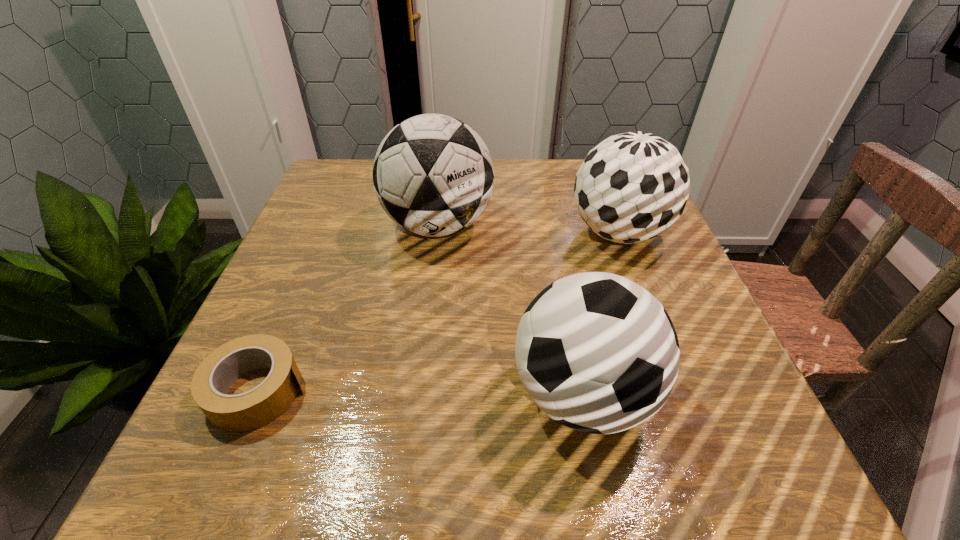
At what (x,y) coordinates should I click in order to perform the action: click on object located in the near left corner section of the desktop. Please return your answer as a coordinate pair (x, y). The height and width of the screenshot is (540, 960). Looking at the image, I should click on (250, 410).

Locate an element on the screen. The image size is (960, 540). object present at the far right corner is located at coordinates (632, 187).

Where is `object at the near right corner`? object at the near right corner is located at coordinates (596, 352).

This screenshot has height=540, width=960. I want to click on blank space at the far edge, so click(563, 183).

Where is `vacant region at the near edge`? vacant region at the near edge is located at coordinates (626, 467).

The width and height of the screenshot is (960, 540). In order to click on vacant space at the right edge of the desktop in this screenshot , I will do `click(676, 310)`.

The image size is (960, 540). I want to click on free location at the far left corner of the desktop, so click(344, 158).

Find the location of a particular element. free space at the near left corner of the desktop is located at coordinates (241, 486).

Identify the location of vacant space at the near right corner. (693, 448).

Locate an element on the screen. The height and width of the screenshot is (540, 960). vacant region between the leftmost soccer ball and the duct tape is located at coordinates (348, 308).